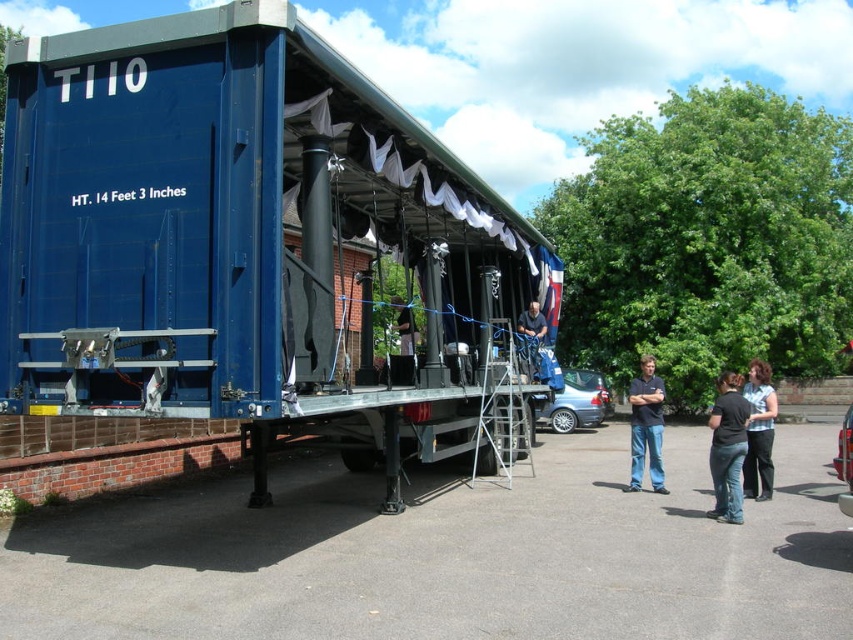
You are a stagehand carrying a 1.2 meter wide equipment box. You need to place it on the ground near the dark blue fabric at center without blocking the black jeans at lower right. Can you fit the box between them?

The black jeans at lower right might be wider than dark blue fabric at center, so there may not be enough space to place the 1.2 meter wide equipment box between them without overlapping. It is uncertain if it will fit.

You are a stagehand setting up equipment. You see the black jeans at lower right and the dark blue fabric at center. Which object is closer to the ground?

The black jeans at lower right is located below dark blue fabric at center, so it is closer to the ground.

You are standing in front of the shipping container stage. There are two points marked on the container. The first point is at coordinate (404, 346) and the second point is at (532, 353). Which point appears closer to you?

The point at coordinate (404, 346) is closer to the camera than the point at (532, 353).